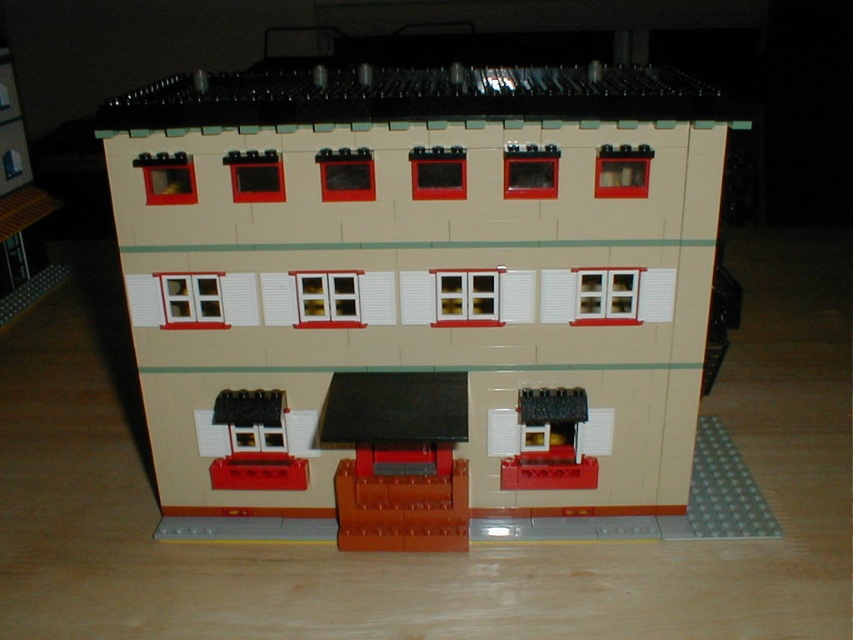
Does point (457, 508) come in front of point (593, 472)?

Yes, it is.

Is point (425, 465) farther from viewer compared to point (560, 404)?

Yes.

Does point (425, 381) lie behind point (553, 403)?

No, it is in front of (553, 403).

At what (x,y) coordinates should I click in order to perform the action: click on smooth brown table at center. Please return your answer as a coordinate pair (x, y). Looking at the image, I should click on (398, 460).

Does beige matte building at center appear on the left side of smooth brown table at center?

In fact, beige matte building at center is to the right of smooth brown table at center.

Who is shorter, beige matte building at center or smooth brown table at center?

With less height is smooth brown table at center.

What do you see at coordinates (421, 296) in the screenshot?
I see `beige matte building at center` at bounding box center [421, 296].

This screenshot has width=853, height=640. I want to click on beige matte building at center, so click(421, 296).

Is beige matte building at center positioned in front of matte black awning at center?

That is True.

Does beige matte building at center have a greater height compared to matte black awning at center?

Yes.

What do you see at coordinates (421, 296) in the screenshot?
I see `beige matte building at center` at bounding box center [421, 296].

At what (x,y) coordinates should I click in order to perform the action: click on beige matte building at center. Please return your answer as a coordinate pair (x, y). Looking at the image, I should click on (421, 296).